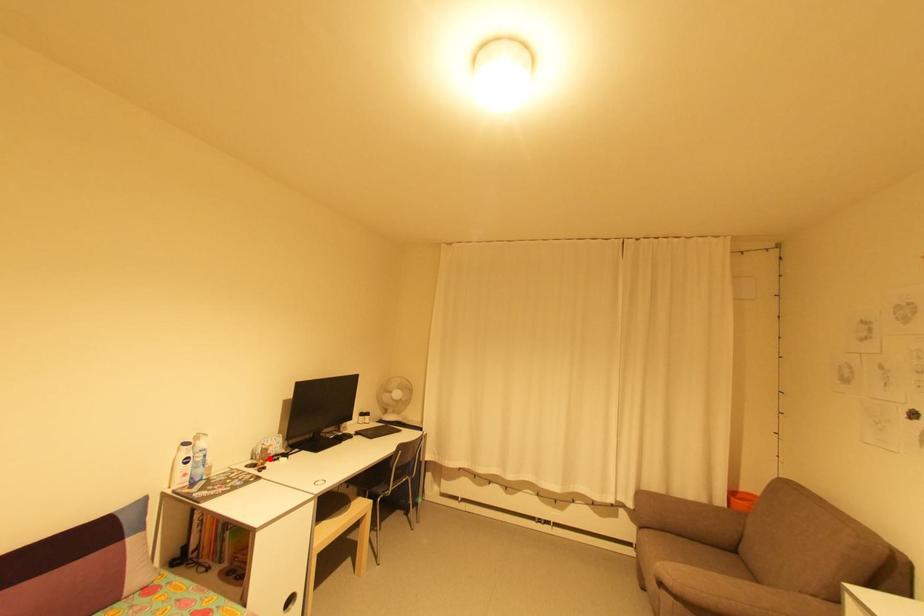
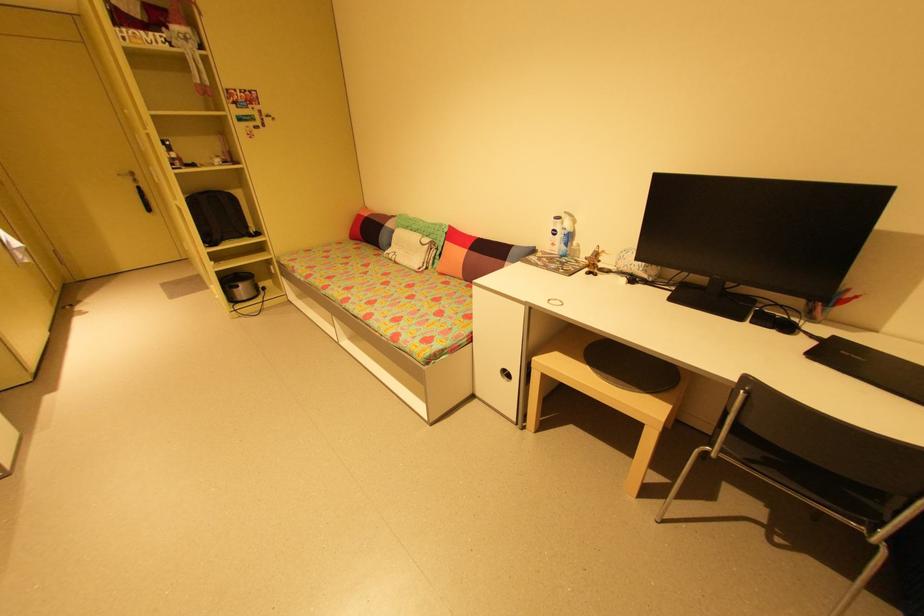
The point at the highlighted location is marked in the first image. Where is the corresponding point in the second image?

(597, 262)